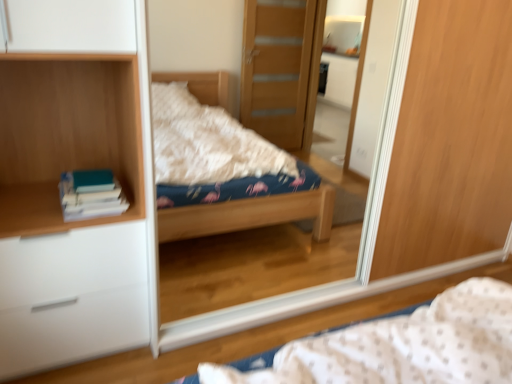
At what (x,y) coordinates should I click in order to perform the action: click on vacant space situated above teal matte book at left (from a real-world perspective). Please return your answer as a coordinate pair (x, y). The width and height of the screenshot is (512, 384). Looking at the image, I should click on (87, 175).